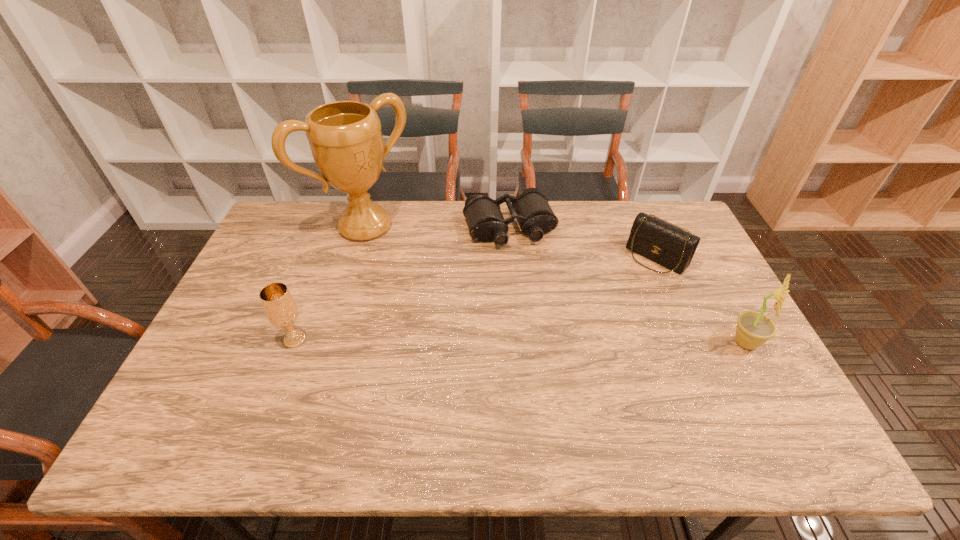
You are a GUI agent. You are given a task and a screenshot of the screen. Output one action in this format:
    pyautogui.click(x=<x>, y=<y>)
    Task: Click on the third tallest object
    
    Given the screenshot: What is the action you would take?
    pyautogui.click(x=278, y=303)

This screenshot has height=540, width=960. I want to click on sunflower, so click(753, 329).

Identify the location of the rightmost object. (753, 329).

Locate an element on the screen. This screenshot has width=960, height=540. the third object from right to left is located at coordinates pyautogui.click(x=531, y=209).

Identify the location of binoculars. The width and height of the screenshot is (960, 540). (531, 209).

Where is `the tallest object`? The width and height of the screenshot is (960, 540). the tallest object is located at coordinates (345, 138).

At what (x,y) coordinates should I click in order to perform the action: click on clutch bag. Please return your answer as a coordinate pair (x, y). The height and width of the screenshot is (540, 960). Looking at the image, I should click on pyautogui.click(x=666, y=244).

The image size is (960, 540). I want to click on the second shortest object, so click(666, 244).

You are a GUI agent. You are given a task and a screenshot of the screen. Output one action in this format:
    pyautogui.click(x=<x>, y=<y>)
    Task: Click on the free spot located 0.160m on the right of the third shortest object
    
    Given the screenshot: What is the action you would take?
    pyautogui.click(x=369, y=340)

Locate an element on the screen. Image resolution: width=960 pixels, height=540 pixels. blank area located through the eyepieces of the shortest object is located at coordinates (541, 301).